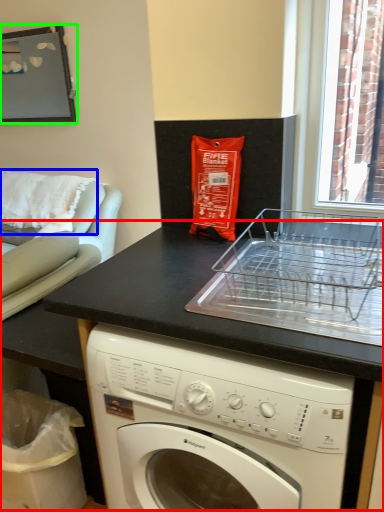
Question: Which object is the closest to the counter (highlighted by a red box)? Choose among these: pillow (highlighted by a blue box) or picture frame (highlighted by a green box).

Choices:
 (A) pillow
 (B) picture frame

Answer: (A)